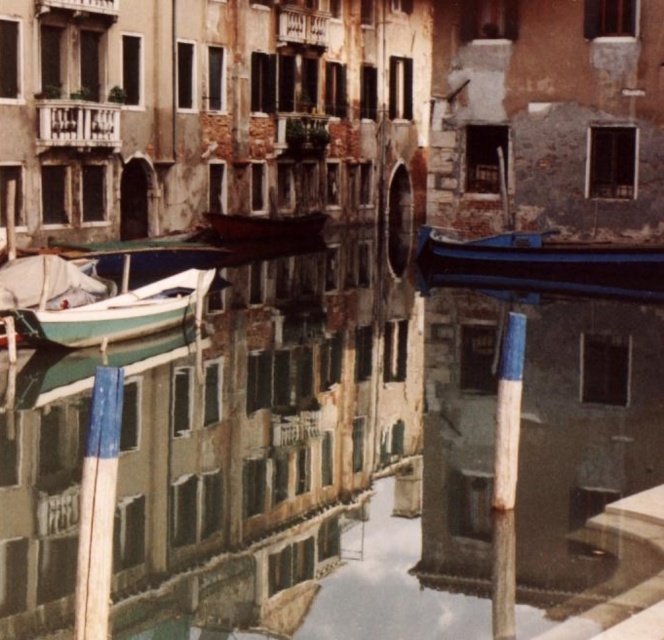
Based on the photo, which is more to the left, blue glossy boat at right or green matte boat at left?

From the viewer's perspective, green matte boat at left appears more on the left side.

Measure the distance between blue glossy boat at right and camera.

The distance of blue glossy boat at right from camera is 51.99 meters.

Measure the distance between blue glossy boat at right and camera.

The distance of blue glossy boat at right from camera is 51.99 meters.

Where is `blue glossy boat at right`? The height and width of the screenshot is (640, 664). blue glossy boat at right is located at coordinates (540, 260).

Can you confirm if blue glossy boat at right is wider than wooden boat at center?

Correct, the width of blue glossy boat at right exceeds that of wooden boat at center.

Does blue glossy boat at right have a larger size compared to wooden boat at center?

Yes, blue glossy boat at right is bigger than wooden boat at center.

Between point (527, 259) and point (228, 214), which one is positioned behind?

Point (228, 214)

Image resolution: width=664 pixels, height=640 pixels. I want to click on blue glossy boat at right, so click(540, 260).

Is smooth concrete canal at center above green matte boat at left?

Incorrect, smooth concrete canal at center is not positioned above green matte boat at left.

Can you confirm if smooth concrete canal at center is shorter than green matte boat at left?

No, smooth concrete canal at center is not shorter than green matte boat at left.

Is point (629, 444) closer to viewer compared to point (29, 330)?

Yes, it is.

Find the location of a particular element. The width and height of the screenshot is (664, 640). smooth concrete canal at center is located at coordinates pyautogui.click(x=386, y=419).